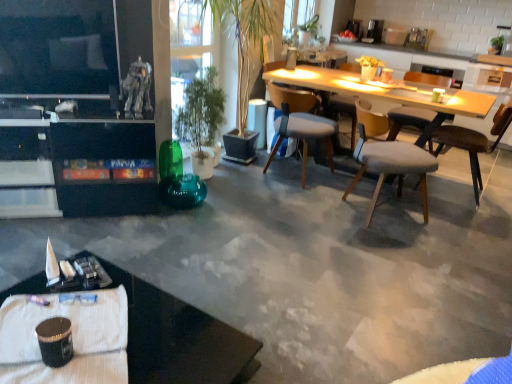
Question: Considering the positions of metallic pen at lower left and green glossy plant at center in the image, is metallic pen at lower left wider or thinner than green glossy plant at center?

Choices:
 (A) wide
 (B) thin

Answer: (B)

Question: Choose the correct answer: Is metallic pen at lower left inside green glossy plant at center or outside it?

Choices:
 (A) inside
 (B) outside

Answer: (B)

Question: Which object is positioned closest to the green glossy plant at center?

Choices:
 (A) brown leather chair at right, which is the 4th chair from left to right
 (B) light wood table at center
 (C) shiny black cup at lower left, which ranks as the first coffee cup in front-to-back order
 (D) green glossy plant at center
 (E) metallic pen at lower left

Answer: (D)

Question: Estimate the real-world distances between objects in this image. Which object is farther from the shiny black cup at lower left, the third coffee cup in the back-to-front sequence?

Choices:
 (A) light wood table at center
 (B) green matte coffee cup at upper right, arranged as the first coffee cup when viewed from the right
 (C) brown leather chair at right, which is the 4th chair from left to right
 (D) satin silver coffee maker at upper center
 (E) light gray fabric chair at center right, which is counted as the second chair, starting from the right

Answer: (D)